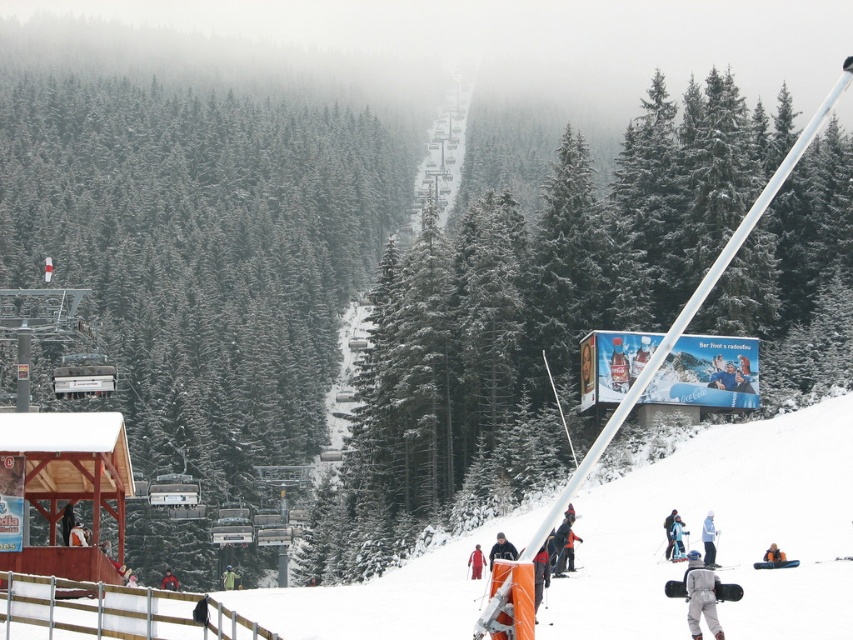
Question: Which point is farther to the camera?

Choices:
 (A) (236, 577)
 (B) (534, 436)
 (C) (769, 556)
 (D) (709, 524)

Answer: (A)

Question: Can you confirm if green snow-covered trees at center is positioned to the left of gray fabric snowsuit at lower right?

Choices:
 (A) no
 (B) yes

Answer: (B)

Question: Which of the following is the farthest from the observer?

Choices:
 (A) (498, 536)
 (B) (666, 534)
 (C) (322, 189)

Answer: (C)

Question: Does dark gray jacket at lower center appear on the left side of red jacket at center?

Choices:
 (A) no
 (B) yes

Answer: (A)

Question: Which object is farther from the camera taking this photo?

Choices:
 (A) orange snowsuit at lower center
 (B) blue matte ski at lower right
 (C) blue snowsuit at lower right

Answer: (A)

Question: Does blue snowsuit at lower right have a lesser width compared to blue fabric snowboarder at center?

Choices:
 (A) no
 (B) yes

Answer: (B)